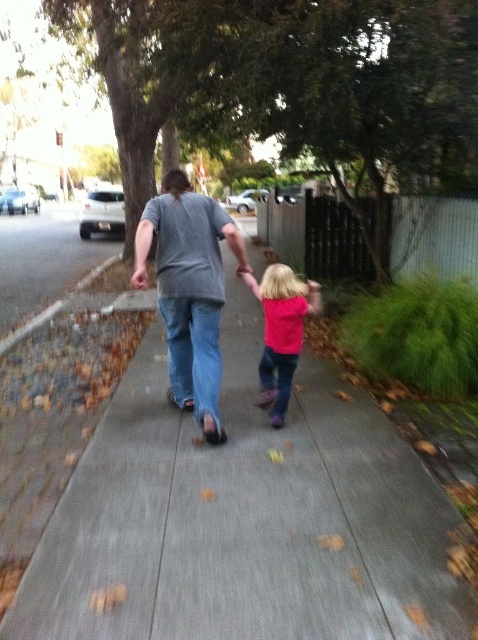
Does point (231, 440) come behind point (293, 298)?

That is False.

Which is in front, point (231, 385) or point (290, 394)?

Point (290, 394)

Identify the location of gray concrete sidewalk at center. This screenshot has width=478, height=640. (245, 516).

Who is positioned more to the right, gray matte shirt at center or pink matte shirt at center?

pink matte shirt at center is more to the right.

Does gray matte shirt at center appear on the right side of pink matte shirt at center?

No, gray matte shirt at center is not to the right of pink matte shirt at center.

You are a GUI agent. You are given a task and a screenshot of the screen. Output one action in this format:
    pyautogui.click(x=<x>, y=<y>)
    Task: Click on the gray matte shirt at center
    Image resolution: width=478 pixels, height=640 pixels.
    Given the screenshot: What is the action you would take?
    click(188, 291)

This screenshot has height=640, width=478. I want to click on gray matte shirt at center, so pos(188,291).

Can you confirm if gray concrete sidewalk at center is positioned above gray matte shirt at center?

Incorrect, gray concrete sidewalk at center is not positioned above gray matte shirt at center.

Does point (230, 445) come farther from viewer compared to point (198, 403)?

No, (230, 445) is closer to viewer.

Does point (301, 412) come behind point (187, 262)?

That is True.

Locate an element on the screen. Image resolution: width=478 pixels, height=640 pixels. gray concrete sidewalk at center is located at coordinates (245, 516).